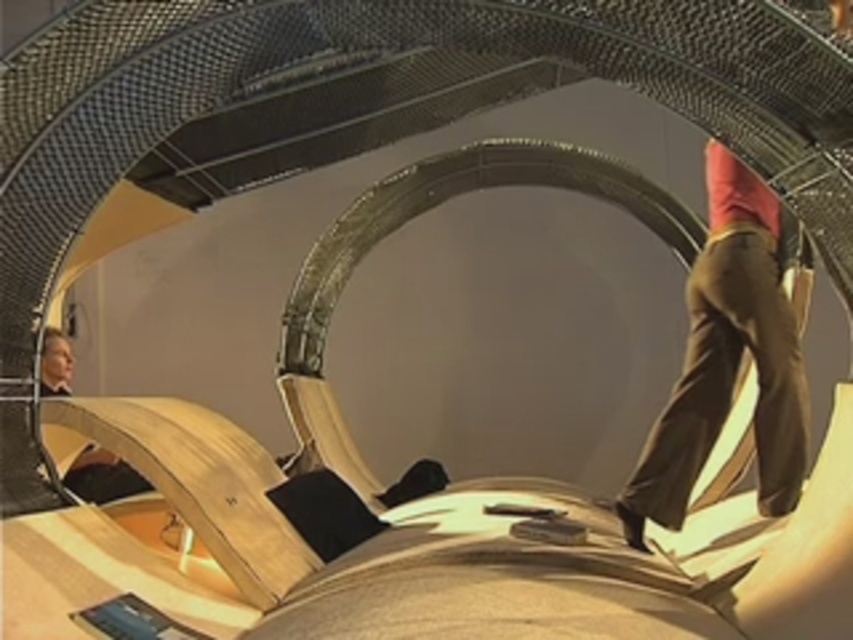
Question: Which point is farther to the camera?

Choices:
 (A) brown leather pants at right
 (B) smooth beige suit at lower left

Answer: (B)

Question: From the image, what is the correct spatial relationship of brown leather pants at right in relation to smooth beige suit at lower left?

Choices:
 (A) below
 (B) above

Answer: (B)

Question: Is brown leather pants at right positioned behind smooth beige suit at lower left?

Choices:
 (A) yes
 (B) no

Answer: (B)

Question: Which point is farther from the camera taking this photo?

Choices:
 (A) (722, 204)
 (B) (115, 476)

Answer: (B)

Question: Is brown leather pants at right to the left of smooth beige suit at lower left from the viewer's perspective?

Choices:
 (A) yes
 (B) no

Answer: (B)

Question: Which of the following is the farthest from the observer?

Choices:
 (A) smooth beige suit at lower left
 (B) brown leather pants at right

Answer: (A)